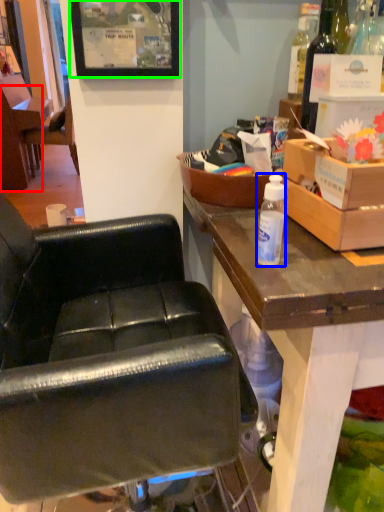
Question: Which object is positioned closest to chair (highlighted by a red box)? Select from bottle (highlighted by a blue box) and picture frame (highlighted by a green box).

Choices:
 (A) bottle
 (B) picture frame

Answer: (B)